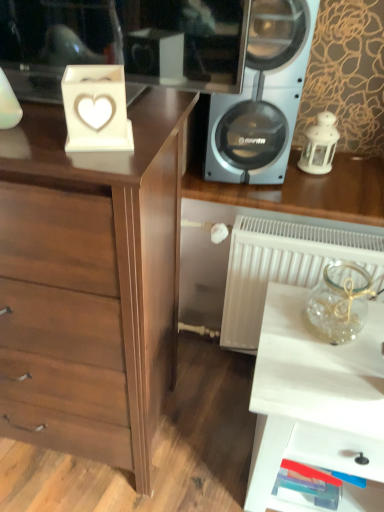
This screenshot has width=384, height=512. Find the location of `vacant space situated on the left part of white matte heart-shaped object at upper left`. vacant space situated on the left part of white matte heart-shaped object at upper left is located at coordinates (31, 139).